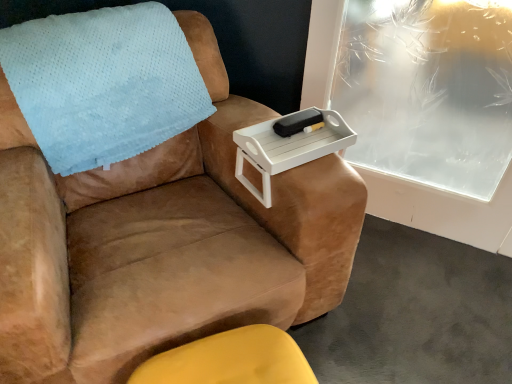
Question: Considering the positions of white plastic tray at upper right and light blue fleece blanket at upper left in the image, is white plastic tray at upper right taller or shorter than light blue fleece blanket at upper left?

Choices:
 (A) tall
 (B) short

Answer: (B)

Question: Considering the positions of white plastic tray at upper right and light blue fleece blanket at upper left in the image, is white plastic tray at upper right wider or thinner than light blue fleece blanket at upper left?

Choices:
 (A) thin
 (B) wide

Answer: (A)

Question: Based on their relative distances, which object is farther from the black matte tray at upper center?

Choices:
 (A) matte yellow ottoman at lower center
 (B) frosted glass tray at upper right
 (C) light blue fleece blanket at upper left
 (D) white plastic tray at upper right
 (E) suede brown armchair at upper right

Answer: (B)

Question: Estimate the real-world distances between objects in this image. Which object is closer to the white plastic tray at upper right?

Choices:
 (A) black matte tray at upper center
 (B) matte yellow ottoman at lower center
 (C) light blue fleece blanket at upper left
 (D) frosted glass tray at upper right
 (E) suede brown armchair at upper right

Answer: (A)